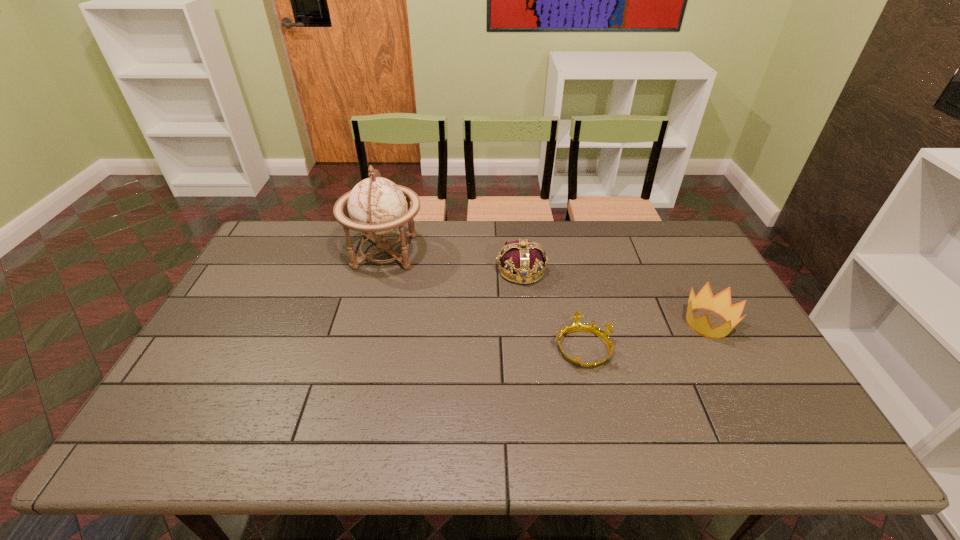
Locate an element on the screen. The image size is (960, 540). vacant region located on the left of the shortest crown is located at coordinates (494, 348).

Locate an element on the screen. This screenshot has height=540, width=960. globe that is at the far edge is located at coordinates (377, 206).

This screenshot has height=540, width=960. Identify the location of crown that is at the far edge. pyautogui.click(x=524, y=259).

Locate an element on the screen. Image resolution: width=960 pixels, height=540 pixels. object present at the right edge is located at coordinates (721, 303).

At what (x,y) coordinates should I click in order to perform the action: click on free space at the far edge. Please return your answer as a coordinate pair (x, y). The width and height of the screenshot is (960, 540). Looking at the image, I should click on (324, 259).

Locate an element on the screen. free space at the near edge is located at coordinates (748, 454).

Locate an element on the screen. blank space at the left edge is located at coordinates (252, 284).

You are a GUI agent. You are given a task and a screenshot of the screen. Output one action in this format:
    pyautogui.click(x=<x>, y=<y>)
    Task: Click on the free space at the right edge of the desktop
    The height and width of the screenshot is (540, 960).
    Given the screenshot: What is the action you would take?
    pyautogui.click(x=710, y=315)

Where is `vacant area between the shortest object and the farthest crown`? vacant area between the shortest object and the farthest crown is located at coordinates (552, 309).

This screenshot has width=960, height=540. In order to click on vacant region between the shortest object and the second tallest object in this screenshot , I will do `click(552, 309)`.